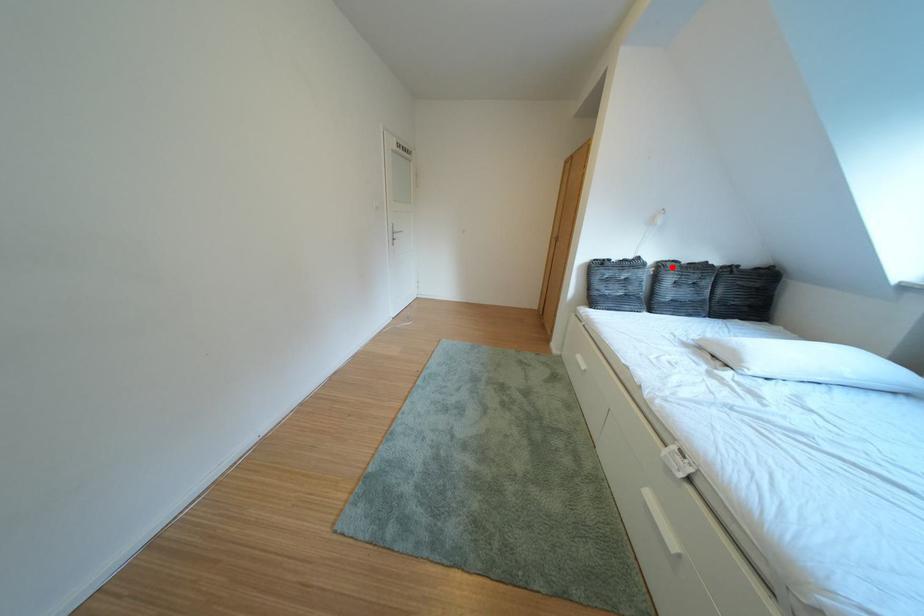
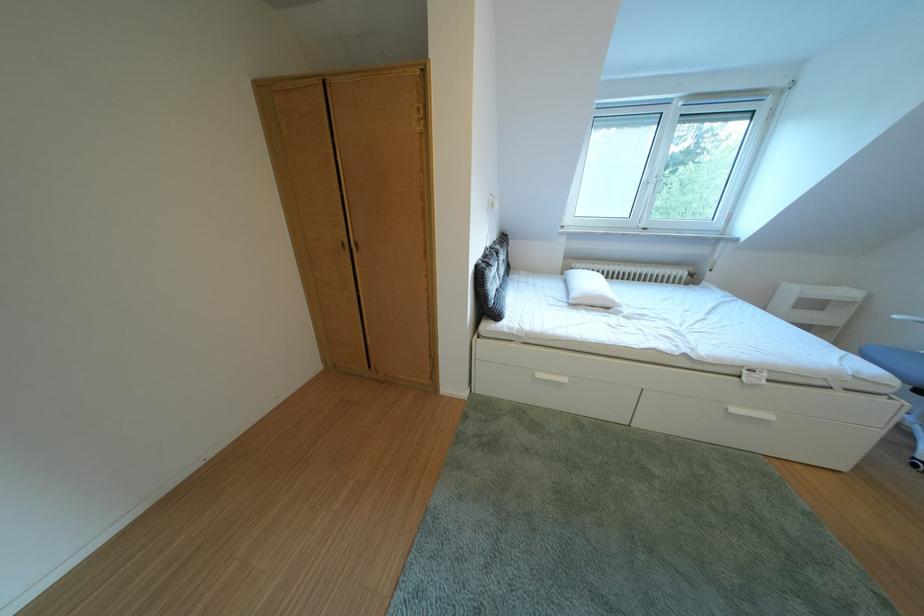
Find the pixel in the second image that matches the highlighted location in the first image.

(505, 254)